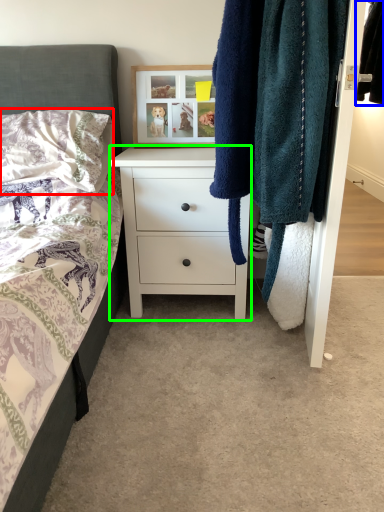
Question: Estimate the real-world distances between objects in this image. Which object is closer to pillow (highlighted by a red box), clothing (highlighted by a blue box) or chest of drawers (highlighted by a green box)?

Choices:
 (A) clothing
 (B) chest of drawers

Answer: (B)